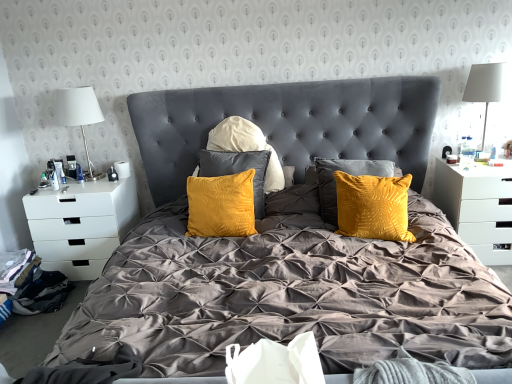
Question: Considering their positions, is white fabric lampshade at left, which is counted as the first table lamp, starting from the left, located in front of or behind white fabric lampshade at upper right, placed as the first table lamp when sorted from right to left?

Choices:
 (A) behind
 (B) front

Answer: (A)

Question: Considering the positions of white fabric lampshade at left, which is counted as the first table lamp, starting from the left, and white fabric lampshade at upper right, which is the second table lamp from left to right, in the image, is white fabric lampshade at left, which is counted as the first table lamp, starting from the left, wider or thinner than white fabric lampshade at upper right, which is the second table lamp from left to right,?

Choices:
 (A) thin
 (B) wide

Answer: (B)

Question: Considering the real-world distances, which object is farthest from the black fabric at lower left?

Choices:
 (A) white fabric lampshade at left, the 2th table lamp viewed from the right
 (B) velvet yellow pillows at center
 (C) white glossy nightstand at right, which ranks as the 2th nightstand in left-to-right order
 (D) white matte drawer at left, which is counted as the second nightstand, starting from the right
 (E) white fabric lampshade at upper right, placed as the first table lamp when sorted from right to left

Answer: (E)

Question: Which object is the farthest from the white matte drawer at left, which is the first nightstand in left-to-right order?

Choices:
 (A) velvet yellow pillows at center
 (B) white fabric lampshade at upper right, placed as the first table lamp when sorted from right to left
 (C) white fabric lampshade at left, which is counted as the first table lamp, starting from the left
 (D) black fabric at lower left
 (E) white glossy nightstand at right, which is the 1th nightstand from right to left

Answer: (B)